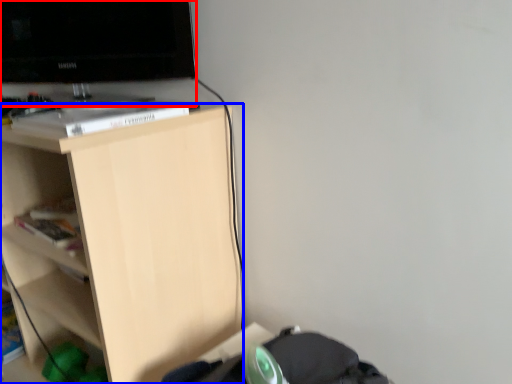
Question: Which point is closer to the camera, television (highlighted by a red box) or shelf (highlighted by a blue box)?

Choices:
 (A) television
 (B) shelf

Answer: (B)